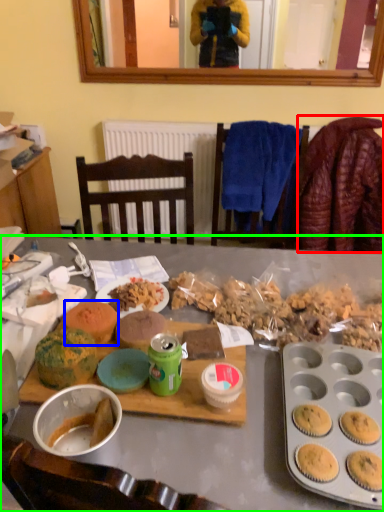
Question: Based on their relative distances, which object is farther from blanket (highlighted by a red box)? Choose from snack (highlighted by a blue box) and desk (highlighted by a green box).

Choices:
 (A) snack
 (B) desk

Answer: (A)